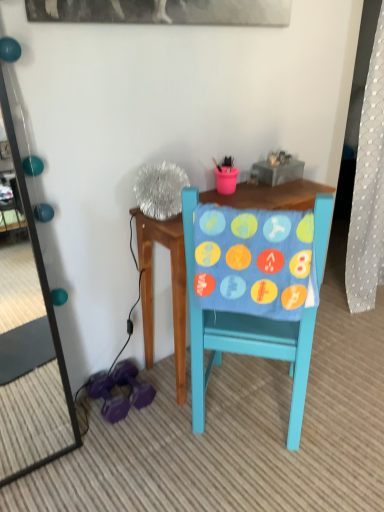
Question: Is matte blue chair at center to the right of teal glossy mirror at left from the viewer's perspective?

Choices:
 (A) no
 (B) yes

Answer: (B)

Question: Can teal glossy mirror at left be found inside matte blue chair at center?

Choices:
 (A) no
 (B) yes

Answer: (A)

Question: Are matte blue chair at center and teal glossy mirror at left making contact?

Choices:
 (A) yes
 (B) no

Answer: (B)

Question: From the image's perspective, is matte blue chair at center located beneath teal glossy mirror at left?

Choices:
 (A) yes
 (B) no

Answer: (A)

Question: From the image's perspective, is matte blue chair at center over teal glossy mirror at left?

Choices:
 (A) no
 (B) yes

Answer: (A)

Question: From a real-world perspective, relative to teal glossy mirror at left, is blue fabric with colorful patches at center vertically above or below?

Choices:
 (A) below
 (B) above

Answer: (A)

Question: Is blue fabric with colorful patches at center taller or shorter than teal glossy mirror at left?

Choices:
 (A) short
 (B) tall

Answer: (A)

Question: In terms of width, does blue fabric with colorful patches at center look wider or thinner when compared to teal glossy mirror at left?

Choices:
 (A) wide
 (B) thin

Answer: (A)

Question: Based on their sizes in the image, would you say blue fabric with colorful patches at center is bigger or smaller than teal glossy mirror at left?

Choices:
 (A) big
 (B) small

Answer: (B)

Question: From the image's perspective, is matte blue chair at center located above or below teal glossy mirror at left?

Choices:
 (A) above
 (B) below

Answer: (B)

Question: Is point (306, 386) positioned closer to the camera than point (31, 224)?

Choices:
 (A) farther
 (B) closer

Answer: (A)

Question: Is matte blue chair at center inside or outside of teal glossy mirror at left?

Choices:
 (A) outside
 (B) inside

Answer: (A)

Question: Is matte blue chair at center taller or shorter than teal glossy mirror at left?

Choices:
 (A) short
 (B) tall

Answer: (B)

Question: Choose the correct answer: Is teal glossy mirror at left inside matte blue chair at center or outside it?

Choices:
 (A) inside
 (B) outside

Answer: (B)

Question: Would you say teal glossy mirror at left is to the left or to the right of matte blue chair at center in the picture?

Choices:
 (A) left
 (B) right

Answer: (A)